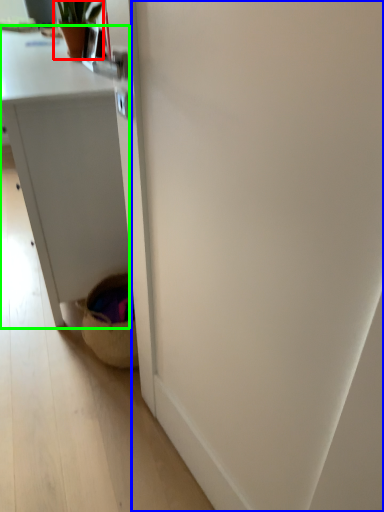
Question: Which is nearer to the houseplant (highlighted by a red box)? screen door (highlighted by a blue box) or desk (highlighted by a green box).

Choices:
 (A) screen door
 (B) desk

Answer: (B)